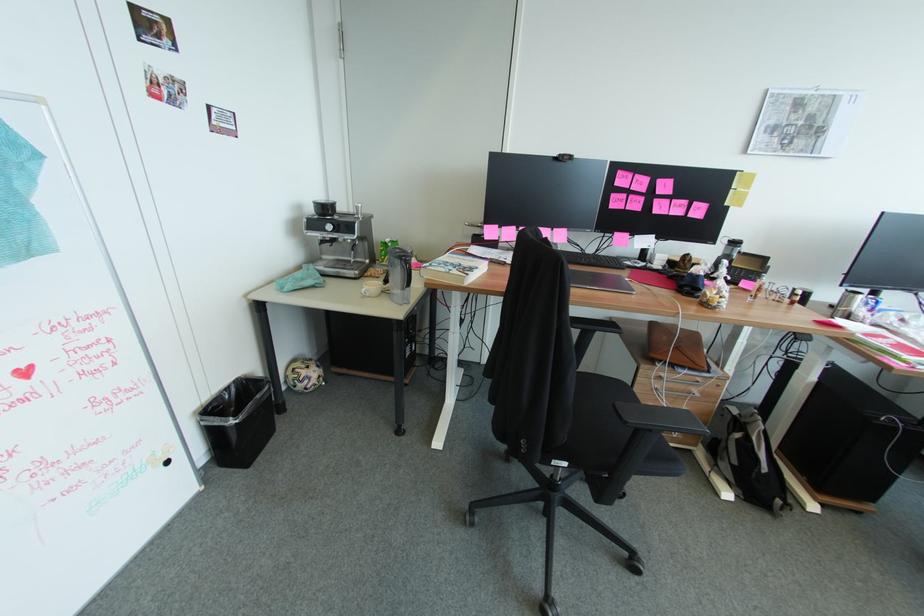
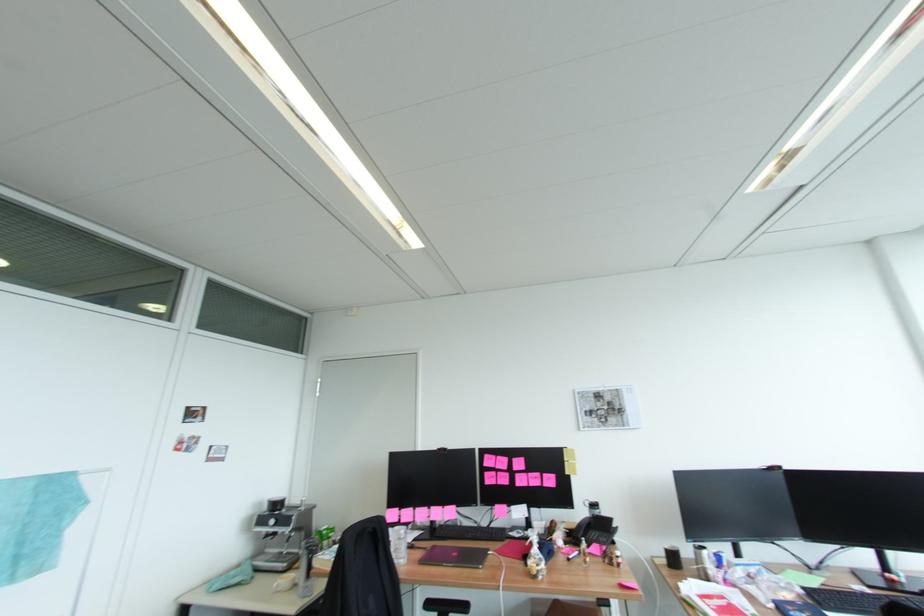
The point at (x=670, y=185) is marked in the first image. Where is the corresponding point in the second image?

(524, 463)